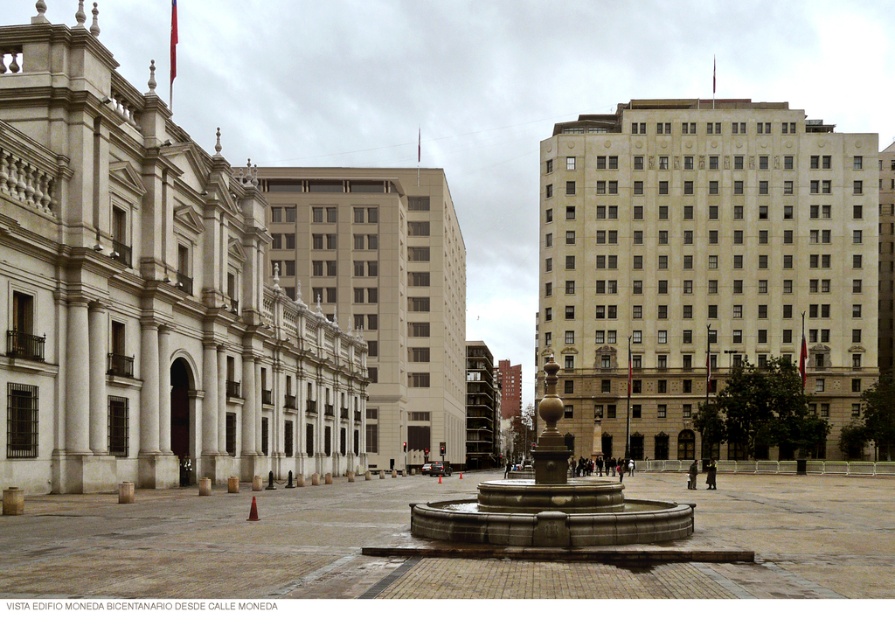
You are standing at point (701, 264) in the public square. What is the nearest object to you?

The nearest object to you at point (701, 264) is the beige stone building at center, as it is located exactly at that coordinate.

You are a tourist standing in the square and want to take a photo of both the beige stone building at center and the granite fountain at center. Which object should you position closer to the camera to ensure both are in frame?

Since the beige stone building at center is taller than the granite fountain at center, you should position the beige stone building at center closer to the camera to ensure both are in frame.

You are a tourist in the square and want to take a photo of both the beige stone building at center and the granite fountain at center. Which object should you position closer to the camera to ensure both fit in the frame?

To ensure both the beige stone building at center and the granite fountain at center fit in the frame, position the camera closer to the granite fountain at center since the beige stone building at center might be wider than the granite fountain at center, requiring more space in the photo.